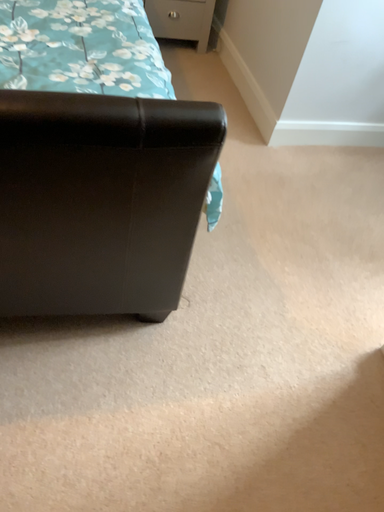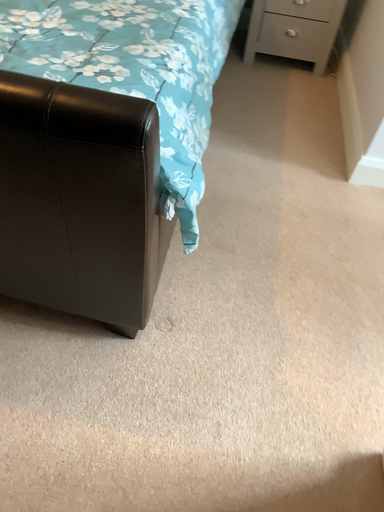
Question: How did the camera likely rotate when shooting the video?

Choices:
 (A) rotated right
 (B) rotated left

Answer: (B)